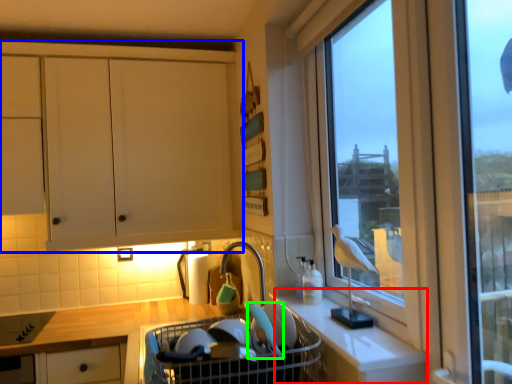
Question: Estimate the real-world distances between objects in this image. Which object is farther from counter (highlighted by a red box), cabinetry (highlighted by a blue box) or appliance (highlighted by a green box)?

Choices:
 (A) cabinetry
 (B) appliance

Answer: (A)